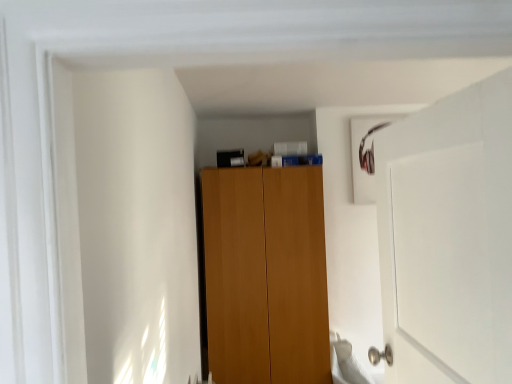
What do you see at coordinates (448, 237) in the screenshot? I see `white glossy door handle at upper right` at bounding box center [448, 237].

Measure the distance between white glossy door handle at upper right and camera.

white glossy door handle at upper right and camera are 28.31 inches apart.

Find the location of `white glossy door handle at upper right`. white glossy door handle at upper right is located at coordinates (448, 237).

In order to face white glossy door handle at upper right, should I rotate leftwards or rightwards?

Turn right by 23.951 degrees to look at white glossy door handle at upper right.

At what (x,y) coordinates should I click in order to perform the action: click on white glossy door handle at upper right. Please return your answer as a coordinate pair (x, y). Looking at the image, I should click on (448, 237).